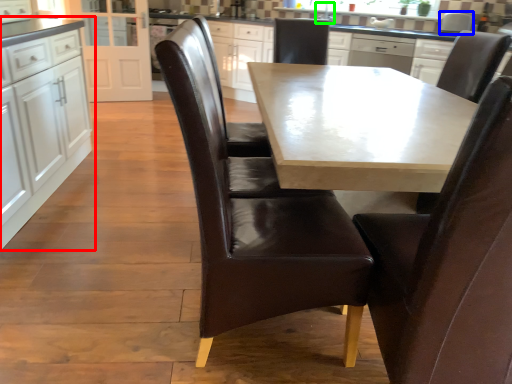
Question: Which object is positioned closest to cabinetry (highlighted by a red box)? Select from appliance (highlighted by a blue box) and sink (highlighted by a green box).

Choices:
 (A) appliance
 (B) sink

Answer: (B)